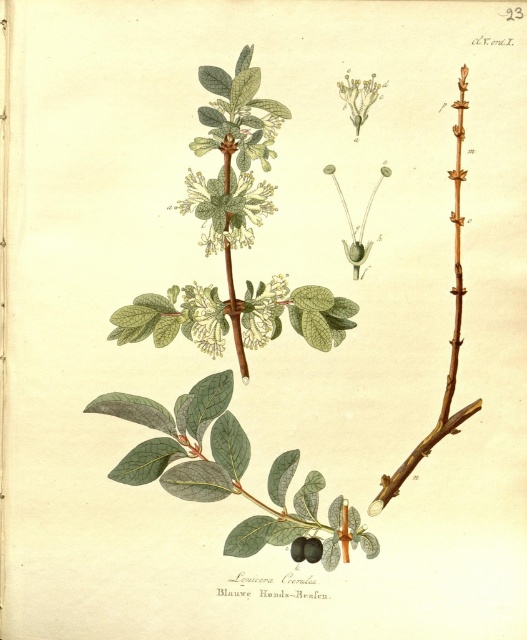
In the botanical illustration of Lonicera caerulea, where is the green leafy plant at upper center positioned relative to the smooth dark purple fruit at center?

The green leafy plant at upper center is positioned to the right of the smooth dark purple fruit at center.

In the botanical illustration of Lonicera caerulea, you observe a green matte flower at center and a shiny purple fruit at center. Which object is closer to the viewer?

The green matte flower at center is closer to the viewer because the shiny purple fruit at center is positioned behind it.